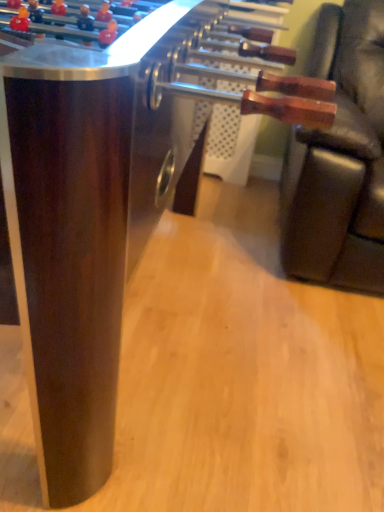
This screenshot has height=512, width=384. What do you see at coordinates (340, 159) in the screenshot? I see `leather couch at right` at bounding box center [340, 159].

Where is `leather couch at right`? The image size is (384, 512). leather couch at right is located at coordinates (340, 159).

Identify the location of leather couch at right. (340, 159).